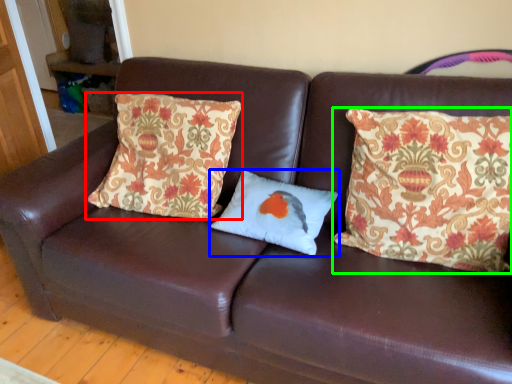
Question: Estimate the real-world distances between objects in this image. Which object is closer to pillow (highlighted by a red box), pillow (highlighted by a blue box) or pillow (highlighted by a green box)?

Choices:
 (A) pillow
 (B) pillow

Answer: (A)